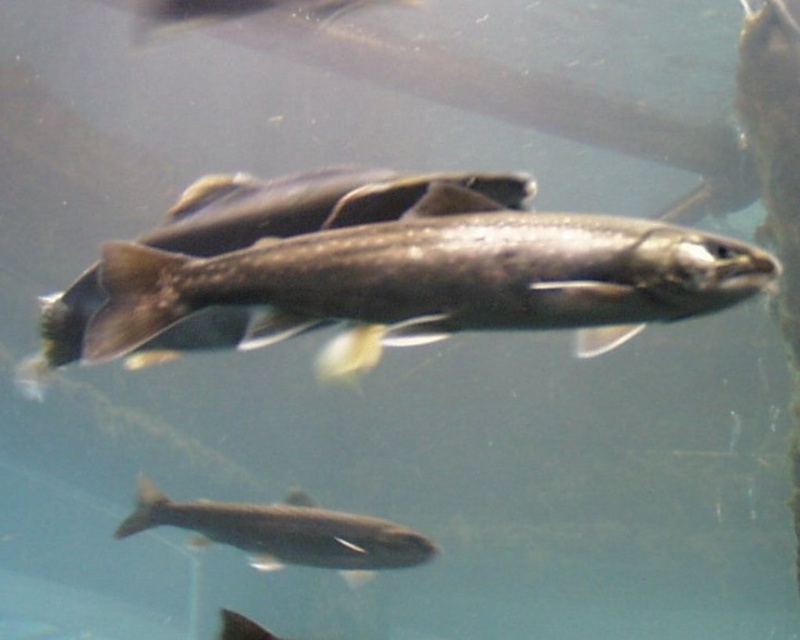
You are an aquatic biologist observing an aquarium. You notice two fish species in the water. The shiny silver fish at center and the silvery metallic fish at bottom center. Which fish is positioned higher in the water column?

The shiny silver fish at center is positioned higher in the water column than the silvery metallic fish at bottom center.

You are a marine biologist observing an underwater scene in an aquarium. You notice a shiny silver fish at center. Can you determine its exact coordinates within the image?

The shiny silver fish at center is located at point (x=433, y=280).